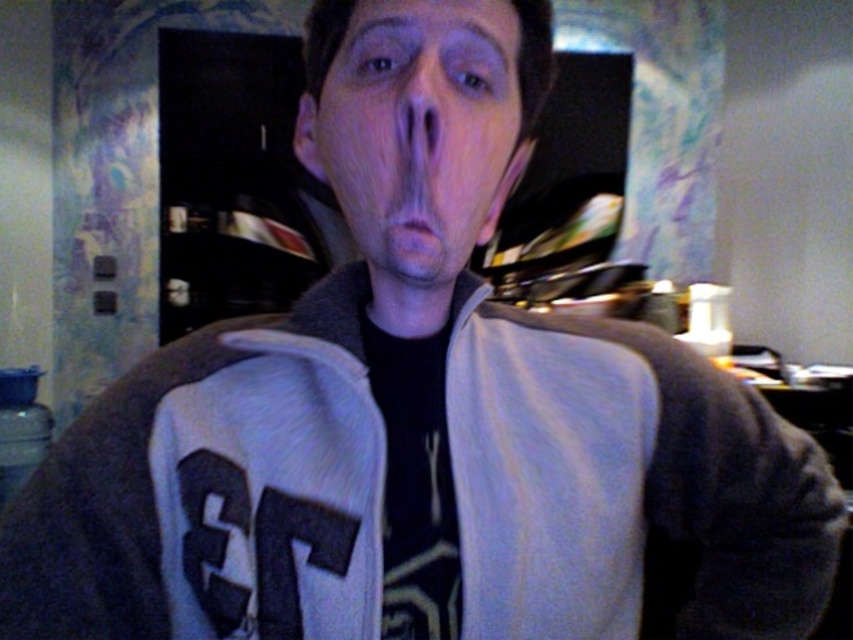
Question: Which point appears farthest from the camera in this image?

Choices:
 (A) (320, 157)
 (B) (403, 147)

Answer: (A)

Question: Based on their relative distances, which object is nearer to the pink matte lips at center?

Choices:
 (A) smooth skin nose at center
 (B) matte skin face at center

Answer: (A)

Question: Which point is closer to the camera?

Choices:
 (A) (404, 83)
 (B) (445, 112)

Answer: (B)

Question: Can you confirm if matte skin face at center is positioned below pink matte lips at center?

Choices:
 (A) no
 (B) yes

Answer: (A)

Question: Is smooth skin nose at center to the right of pink matte lips at center from the viewer's perspective?

Choices:
 (A) yes
 (B) no

Answer: (A)

Question: Is matte skin face at center bigger than pink matte lips at center?

Choices:
 (A) no
 (B) yes

Answer: (B)